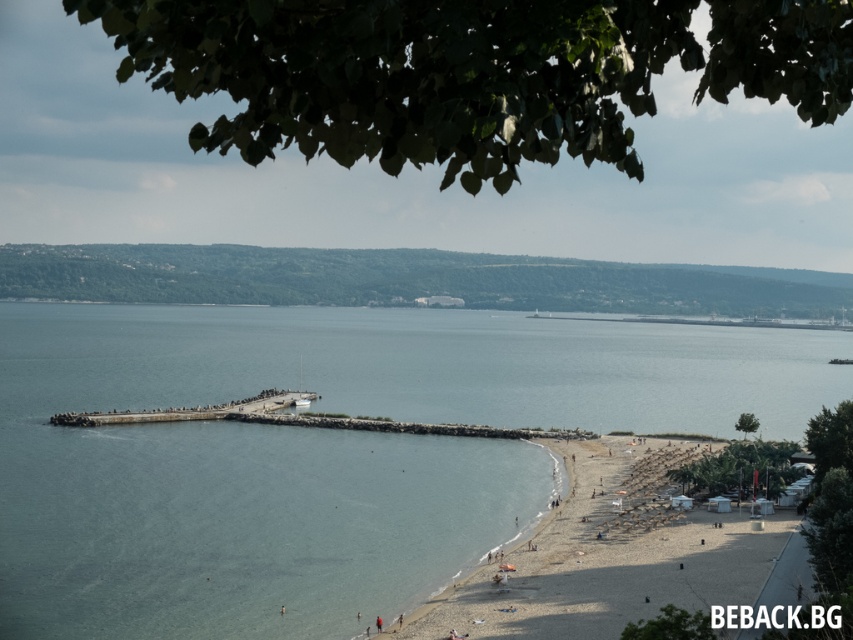
Question: Does light brown sand at lower right appear over dark gray concrete pier at center-left?

Choices:
 (A) no
 (B) yes

Answer: (A)

Question: Which is farther from the dark gray concrete pier at center-left?

Choices:
 (A) light brown sand at lower right
 (B) clear blue water at center

Answer: (A)

Question: Among these points, which one is nearest to the camera?

Choices:
 (A) (281, 401)
 (B) (527, 636)
 (C) (149, 522)

Answer: (B)

Question: Is light brown sand at lower right above dark gray concrete pier at center-left?

Choices:
 (A) no
 (B) yes

Answer: (A)

Question: Which is farther from the clear blue water at center?

Choices:
 (A) dark gray concrete pier at center-left
 (B) light brown sand at lower right

Answer: (B)

Question: From the image, what is the correct spatial relationship of clear blue water at center in relation to dark gray concrete pier at center-left?

Choices:
 (A) left
 (B) right

Answer: (B)